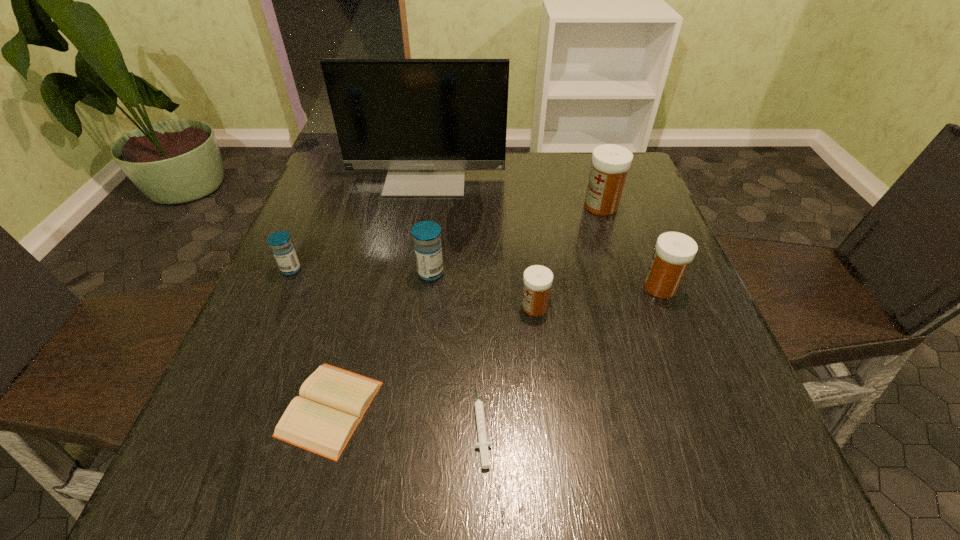
The height and width of the screenshot is (540, 960). What are the coordinates of `computer monitor` in the screenshot? It's located at (426, 121).

This screenshot has height=540, width=960. In order to click on the farthest white medicine in this screenshot , I will do `click(610, 163)`.

The width and height of the screenshot is (960, 540). In order to click on the farthest medicine in this screenshot , I will do `click(610, 163)`.

The height and width of the screenshot is (540, 960). I want to click on the second medicine from left to right, so click(x=427, y=244).

Identify the location of the bigger blue medicine. (427, 244).

At what (x,y) coordinates should I click in order to perform the action: click on the second smallest white medicine. Please return your answer as a coordinate pair (x, y). The image size is (960, 540). Looking at the image, I should click on (674, 251).

Locate an element on the screen. the left blue medicine is located at coordinates (280, 242).

You are a GUI agent. You are given a task and a screenshot of the screen. Output one action in this format:
    pyautogui.click(x=<x>, y=<y>)
    Task: Click on the smaller blue medicine
    The height and width of the screenshot is (540, 960).
    Given the screenshot: What is the action you would take?
    pyautogui.click(x=280, y=242)

Where is `the third object from right to left`? the third object from right to left is located at coordinates (537, 279).

Where is `the smallest white medicine`? The height and width of the screenshot is (540, 960). the smallest white medicine is located at coordinates (537, 279).